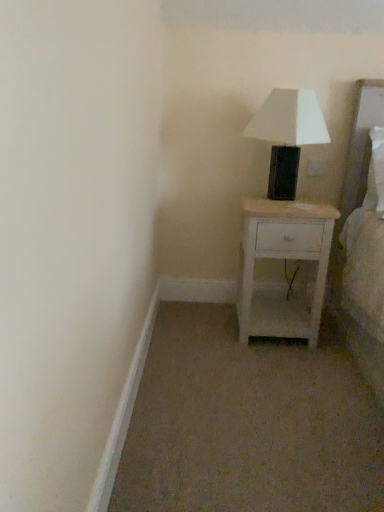
Describe the element at coordinates (287, 135) in the screenshot. I see `white matte table lamp at upper right` at that location.

Locate an element on the screen. white matte table lamp at upper right is located at coordinates (287, 135).

The width and height of the screenshot is (384, 512). What do you see at coordinates (284, 259) in the screenshot?
I see `white wood nightstand at center` at bounding box center [284, 259].

Where is `white wood nightstand at center`? white wood nightstand at center is located at coordinates (284, 259).

This screenshot has width=384, height=512. Identify the location of white matte table lamp at upper right. [x=287, y=135].

Is white matte table lamp at upper right to the left or to the right of white wood nightstand at center in the image?

white matte table lamp at upper right is to the right of white wood nightstand at center.

Considering the relative positions of white matte table lamp at upper right and white wood nightstand at center in the image provided, is white matte table lamp at upper right behind white wood nightstand at center?

No, the depth of white matte table lamp at upper right is less than that of white wood nightstand at center.

Between point (285, 118) and point (248, 227), which one is positioned in front?

Positioned in front is point (285, 118).

From the image's perspective, is white matte table lamp at upper right beneath white wood nightstand at center?

Actually, white matte table lamp at upper right appears above white wood nightstand at center in the image.

From a real-world perspective, who is located lower, white matte table lamp at upper right or white wood nightstand at center?

white wood nightstand at center is physically lower.

Considering the sizes of white matte table lamp at upper right and white wood nightstand at center in the image, is white matte table lamp at upper right wider or thinner than white wood nightstand at center?

Considering their sizes, white matte table lamp at upper right looks slimmer than white wood nightstand at center.

Which of these two, white matte table lamp at upper right or white wood nightstand at center, stands shorter?

white matte table lamp at upper right is shorter.

In the scene shown: Based on their sizes in the image, would you say white matte table lamp at upper right is bigger or smaller than white wood nightstand at center?

In the image, white matte table lamp at upper right appears to be smaller than white wood nightstand at center.

Is white matte table lamp at upper right spatially inside white wood nightstand at center, or outside of it?

white matte table lamp at upper right is outside white wood nightstand at center.

Is the surface of white matte table lamp at upper right in direct contact with white wood nightstand at center?

No, white matte table lamp at upper right is not making contact with white wood nightstand at center.

Is white matte table lamp at upper right facing away from white wood nightstand at center?

No, white matte table lamp at upper right's orientation is not away from white wood nightstand at center.

How different are the orientations of white matte table lamp at upper right and white wood nightstand at center in degrees?

white matte table lamp at upper right and white wood nightstand at center are facing 0.00042 degrees away from each other.

Identify the location of nightstand on the left of white matte table lamp at upper right. (284, 259).

Visually, is white wood nightstand at center positioned to the left or to the right of white matte table lamp at upper right?

From the image, it's evident that white wood nightstand at center is to the left of white matte table lamp at upper right.

Does white wood nightstand at center come in front of white matte table lamp at upper right?

No, white wood nightstand at center is behind white matte table lamp at upper right.

Does point (247, 252) come closer to viewer compared to point (278, 126)?

No.

From the image's perspective, is white wood nightstand at center positioned above or below white matte table lamp at upper right?

white wood nightstand at center is situated lower than white matte table lamp at upper right in the image.

From a real-world perspective, which is physically below, white wood nightstand at center or white matte table lamp at upper right?

white wood nightstand at center.

Does white wood nightstand at center have a greater width compared to white matte table lamp at upper right?

Correct, the width of white wood nightstand at center exceeds that of white matte table lamp at upper right.

Considering the relative sizes of white wood nightstand at center and white matte table lamp at upper right in the image provided, is white wood nightstand at center shorter than white matte table lamp at upper right?

No, white wood nightstand at center is not shorter than white matte table lamp at upper right.

Consider the image. Considering the relative sizes of white wood nightstand at center and white matte table lamp at upper right in the image provided, is white wood nightstand at center bigger than white matte table lamp at upper right?

Yes, white wood nightstand at center is bigger than white matte table lamp at upper right.

Is white wood nightstand at center completely or partially outside of white matte table lamp at upper right?

Indeed, white wood nightstand at center is completely outside white matte table lamp at upper right.

Is white wood nightstand at center not near white matte table lamp at upper right?

Actually, white wood nightstand at center and white matte table lamp at upper right are a little close together.

Is white wood nightstand at center aimed at white matte table lamp at upper right?

No, white wood nightstand at center is not facing towards white matte table lamp at upper right.

How different are the orientations of white wood nightstand at center and white matte table lamp at upper right in degrees?

0.00042 degrees separate the facing orientations of white wood nightstand at center and white matte table lamp at upper right.

How distant is white wood nightstand at center from white matte table lamp at upper right?

white wood nightstand at center and white matte table lamp at upper right are 34.66 centimeters apart.

Locate an element on the screen. The image size is (384, 512). nightstand beneath the white matte table lamp at upper right (from a real-world perspective) is located at coordinates (284, 259).

Where is `nightstand behind the white matte table lamp at upper right`? This screenshot has height=512, width=384. nightstand behind the white matte table lamp at upper right is located at coordinates (284, 259).

I want to click on table lamp in front of the white wood nightstand at center, so click(x=287, y=135).